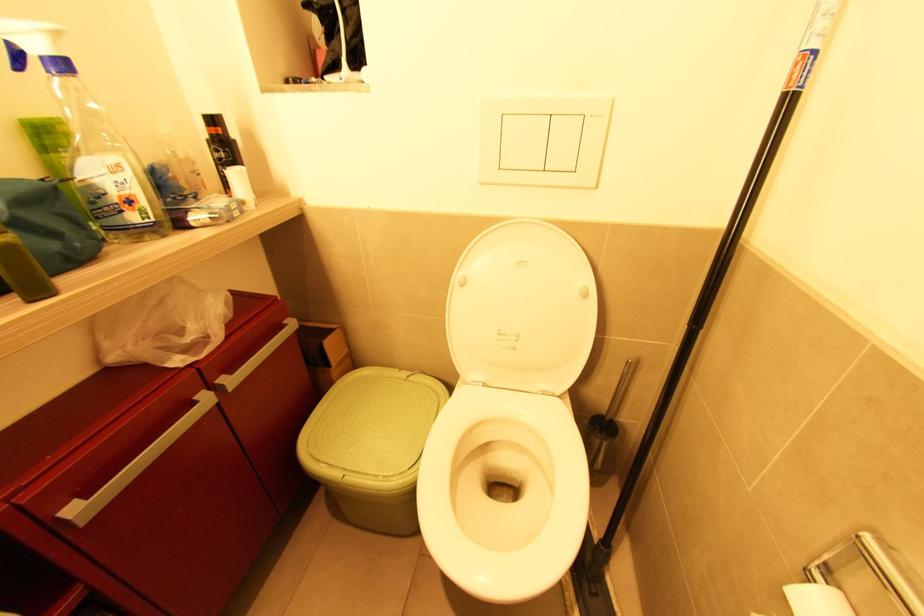
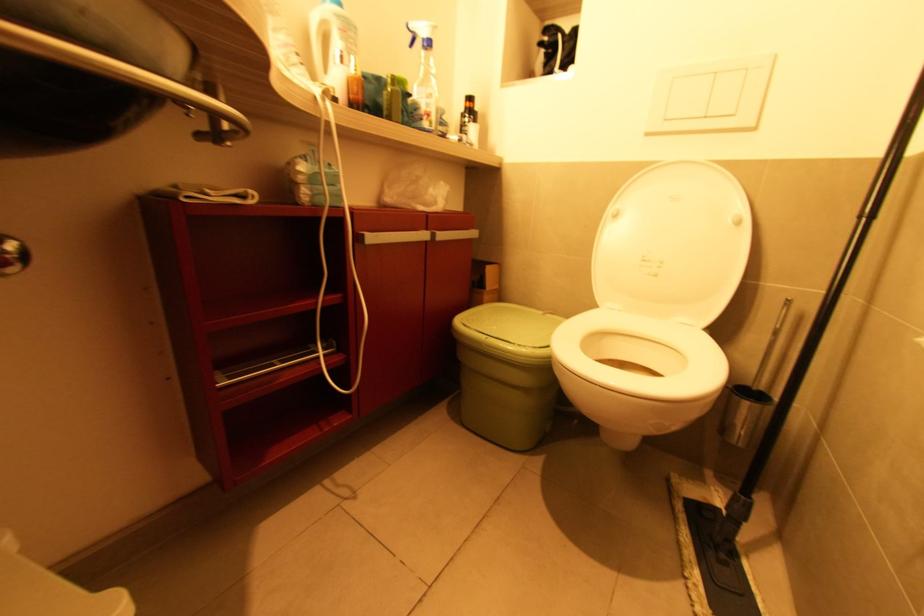
Find the pixel in the second image that matches the point at 465,285 in the first image.

(617, 217)